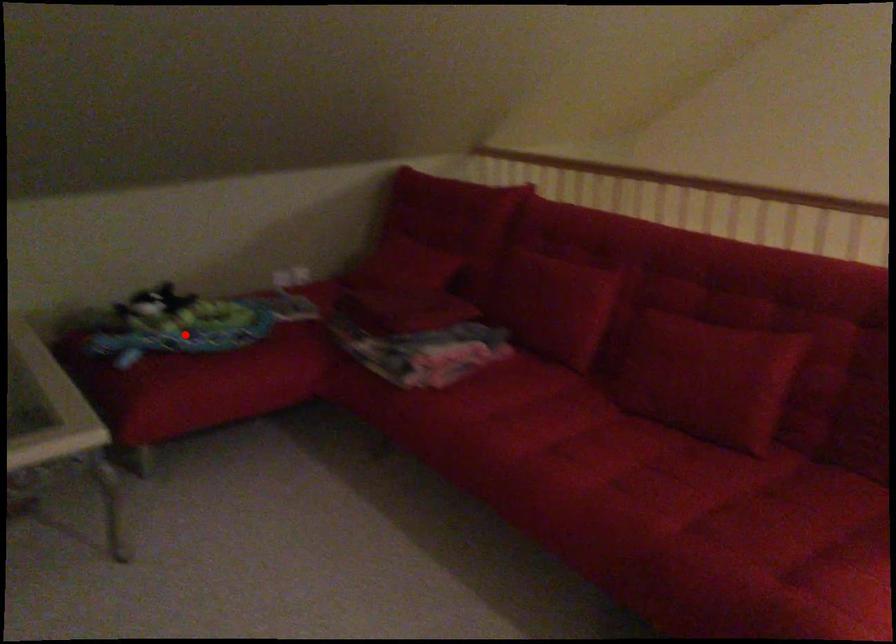
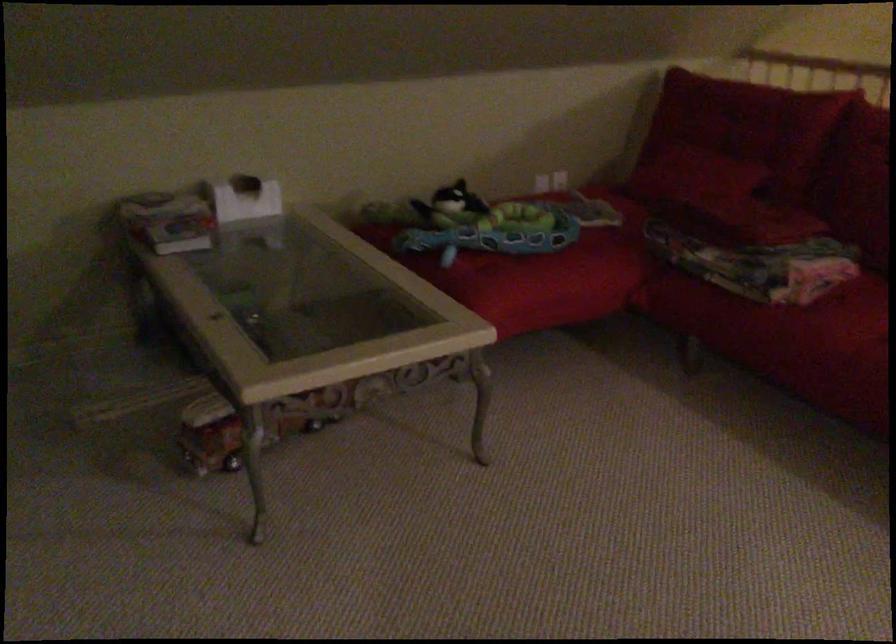
Find the pixel in the second image that matches the highlighted location in the first image.

(495, 232)